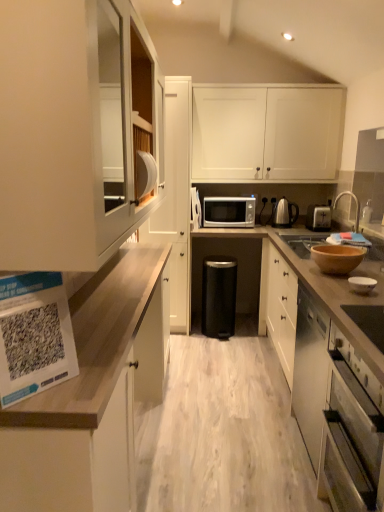
Find the location of `vacant region to the left of black matte trash can at center`. vacant region to the left of black matte trash can at center is located at coordinates (189, 333).